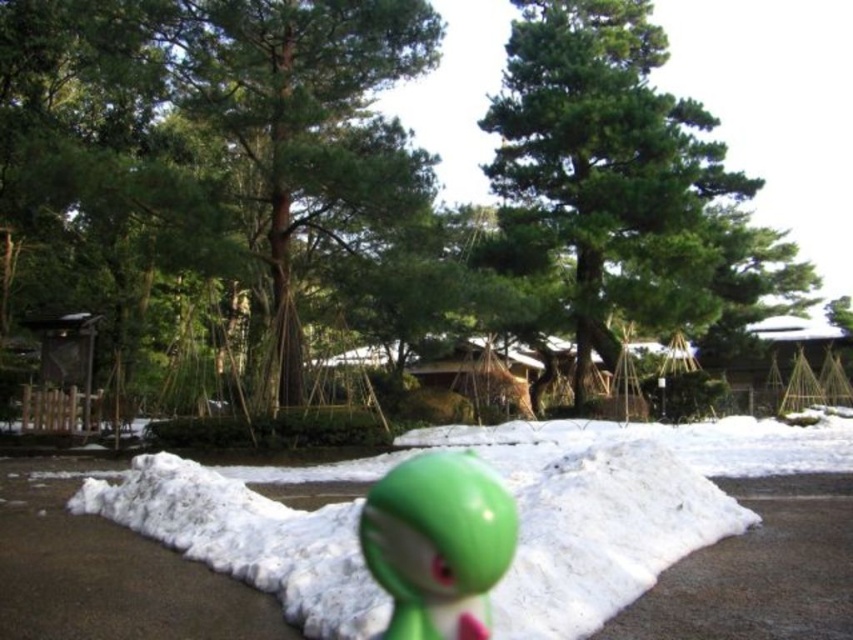
Is green matte tree at center to the left of green matte toy at center from the viewer's perspective?

In fact, green matte tree at center is to the right of green matte toy at center.

In order to click on green matte tree at center in this screenshot , I will do `click(368, 179)`.

The width and height of the screenshot is (853, 640). Find the location of `green matte tree at center`. green matte tree at center is located at coordinates (368, 179).

Is green matte tree at center to the right of white fluffy snow at center from the viewer's perspective?

Correct, you'll find green matte tree at center to the right of white fluffy snow at center.

Is green matte tree at center taller than white fluffy snow at center?

Yes, green matte tree at center is taller than white fluffy snow at center.

Is point (339, 305) closer to viewer compared to point (293, 595)?

No.

Where is `green matte tree at center`? Image resolution: width=853 pixels, height=640 pixels. green matte tree at center is located at coordinates (368, 179).

Does white fluffy snow at center have a greater width compared to green matte toy at center?

Yes.

I want to click on white fluffy snow at center, so click(624, 502).

The image size is (853, 640). I want to click on white fluffy snow at center, so click(624, 502).

This screenshot has width=853, height=640. In order to click on white fluffy snow at center in this screenshot , I will do `click(624, 502)`.